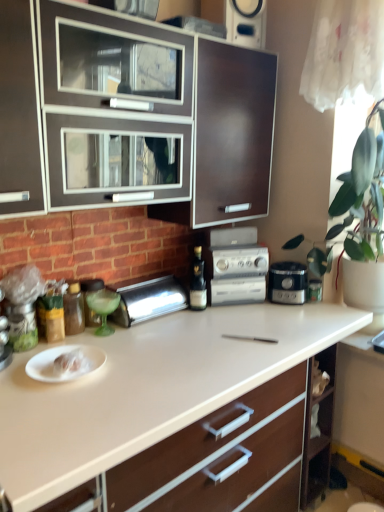
Image resolution: width=384 pixels, height=512 pixels. Identify the location of free space in front of silver metallic breadbox at left, which ranks as the second appliance in left-to-right order. (152, 334).